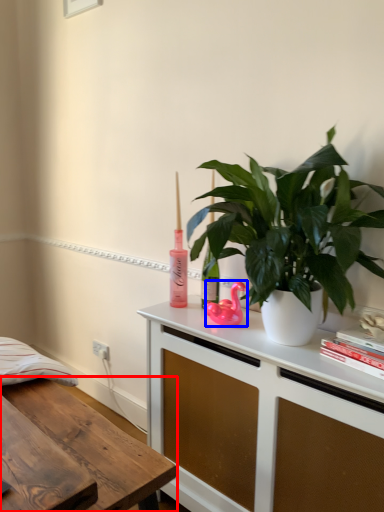
Question: Among these objects, which one is nearest to the camera, desk (highlighted by a red box) or appliance (highlighted by a blue box)?

Choices:
 (A) desk
 (B) appliance

Answer: (A)